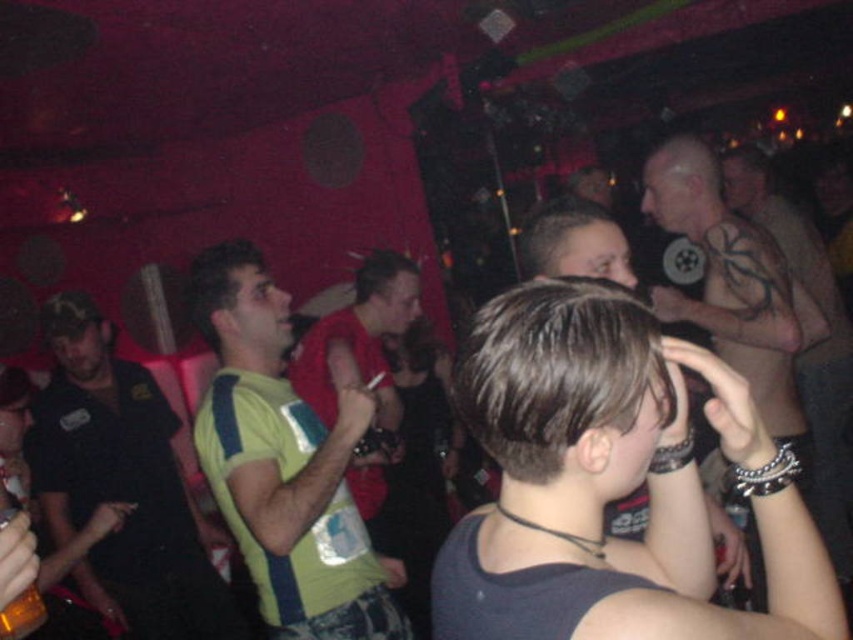
Consider the image. Does green fabric shirt at left come in front of red matte shirt at center?

No, it is not.

Who is shorter, green fabric shirt at left or red matte shirt at center?

With less height is red matte shirt at center.

Describe the element at coordinates (122, 483) in the screenshot. Image resolution: width=853 pixels, height=640 pixels. I see `green fabric shirt at left` at that location.

Locate an element on the screen. Image resolution: width=853 pixels, height=640 pixels. green fabric shirt at left is located at coordinates (122, 483).

Is green fabric shirt at left smaller than translucent amber liquid at lower left?

Actually, green fabric shirt at left might be larger than translucent amber liquid at lower left.

Does green fabric shirt at left have a lesser height compared to translucent amber liquid at lower left?

In fact, green fabric shirt at left may be taller than translucent amber liquid at lower left.

In order to click on green fabric shirt at left in this screenshot , I will do `click(122, 483)`.

The height and width of the screenshot is (640, 853). Identify the location of green fabric shirt at left. (122, 483).

Is point (775, 580) in front of point (376, 262)?

Yes, it is in front of point (376, 262).

Who is shorter, dark gray tank top at center or red matte shirt at center?

dark gray tank top at center

This screenshot has width=853, height=640. What do you see at coordinates (611, 483) in the screenshot? I see `dark gray tank top at center` at bounding box center [611, 483].

Locate an element on the screen. Image resolution: width=853 pixels, height=640 pixels. dark gray tank top at center is located at coordinates (611, 483).